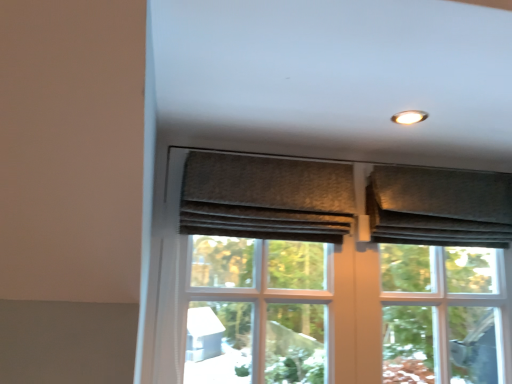
Question: Should I look upward or downward to see textured gray fabric at upper right?

Choices:
 (A) up
 (B) down

Answer: (B)

Question: Does textured gray curtain at upper center, which ranks as the second curtain in right-to-left order, contain textured gray fabric at upper right?

Choices:
 (A) yes
 (B) no

Answer: (B)

Question: Is textured gray curtain at upper center, which is the 1th curtain in left-to-right order, smaller than textured gray fabric at upper right?

Choices:
 (A) no
 (B) yes

Answer: (B)

Question: Is textured gray curtain at upper center, which ranks as the second curtain in right-to-left order, looking in the opposite direction of textured gray fabric at upper right?

Choices:
 (A) no
 (B) yes

Answer: (A)

Question: From the image's perspective, is textured gray curtain at upper center, which ranks as the second curtain in right-to-left order, over textured gray fabric at upper right?

Choices:
 (A) no
 (B) yes

Answer: (B)

Question: Does textured gray curtain at upper center, which ranks as the second curtain in right-to-left order, turn towards textured gray fabric at upper right?

Choices:
 (A) no
 (B) yes

Answer: (A)

Question: Is textured gray curtain at upper center, which ranks as the second curtain in right-to-left order, wider than textured gray fabric at upper right?

Choices:
 (A) no
 (B) yes

Answer: (B)

Question: Considering the relative sizes of textured gray fabric at upper right and textured gray curtain at upper center, which ranks as the second curtain in right-to-left order, in the image provided, is textured gray fabric at upper right shorter than textured gray curtain at upper center, which ranks as the second curtain in right-to-left order,?

Choices:
 (A) no
 (B) yes

Answer: (A)

Question: Does textured gray fabric at upper right have a greater height compared to textured gray curtain at upper center, which is the 1th curtain in left-to-right order?

Choices:
 (A) yes
 (B) no

Answer: (A)

Question: From a real-world perspective, is textured gray fabric at upper right on top of textured gray curtain at upper center, which ranks as the second curtain in right-to-left order?

Choices:
 (A) no
 (B) yes

Answer: (A)

Question: Does textured gray fabric at upper right appear on the right side of textured gray curtain at upper center, which ranks as the second curtain in right-to-left order?

Choices:
 (A) yes
 (B) no

Answer: (A)

Question: From the image's perspective, is textured gray fabric at upper right beneath textured gray curtain at upper center, which is the 1th curtain in left-to-right order?

Choices:
 (A) no
 (B) yes

Answer: (B)

Question: Can textured gray curtain at upper center, which ranks as the second curtain in right-to-left order, be found inside textured gray fabric at upper right?

Choices:
 (A) no
 (B) yes

Answer: (A)

Question: Can we say matte brown screen door at center lies outside textured gray curtain at upper center, which ranks as the second curtain in right-to-left order?

Choices:
 (A) yes
 (B) no

Answer: (A)